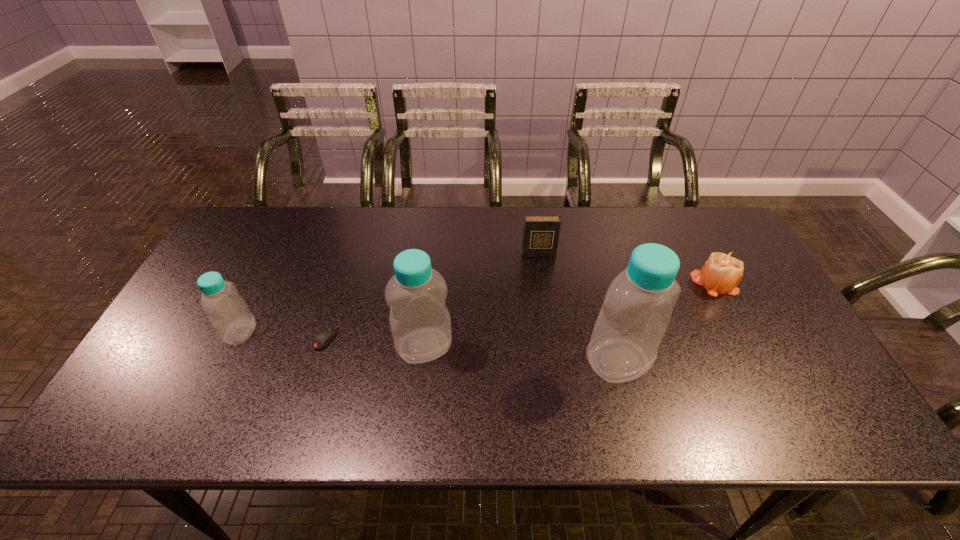
Where is `candle`? candle is located at coordinates (722, 272).

The width and height of the screenshot is (960, 540). I want to click on vacant space situated 0.080m on the right of the shortest bottle, so click(285, 332).

The width and height of the screenshot is (960, 540). In order to click on free space located on the right of the fourth object from right to left in this screenshot , I will do `click(570, 346)`.

Where is `vacant space located on the right of the rightmost bottle`? Image resolution: width=960 pixels, height=540 pixels. vacant space located on the right of the rightmost bottle is located at coordinates (757, 361).

At what (x,y) coordinates should I click in order to perform the action: click on free region located on the front cover of the fourth object from left to right. Please return your answer as a coordinate pair (x, y). Image resolution: width=960 pixels, height=540 pixels. Looking at the image, I should click on (549, 332).

Locate an element on the screen. vacant space located on the left of the computer mouse is located at coordinates (199, 338).

Identify the location of free region located 0.340m on the left of the candle. (576, 283).

Image resolution: width=960 pixels, height=540 pixels. Identify the location of object that is at the far edge. (541, 233).

Locate an element on the screen. object present at the near edge is located at coordinates (637, 309).

Identify the location of object that is at the left edge. This screenshot has height=540, width=960. pyautogui.click(x=231, y=318).